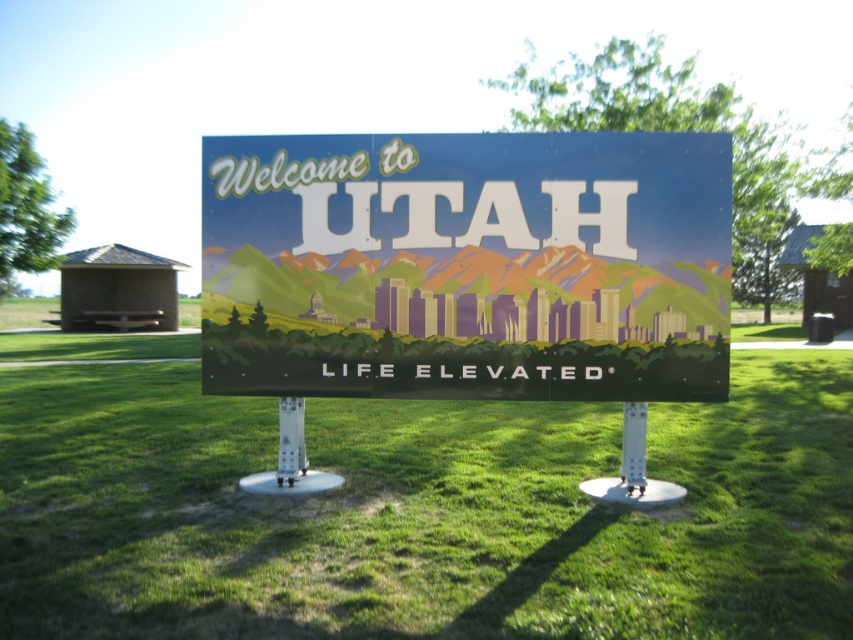
Question: Which point appears closest to the camera in this image?

Choices:
 (A) (634, 278)
 (B) (635, 484)
 (C) (604, 435)

Answer: (A)

Question: Does green grass at center have a larger size compared to white plastic pole at center?

Choices:
 (A) no
 (B) yes

Answer: (B)

Question: Does matte plastic sign at center come behind white plastic pole at center?

Choices:
 (A) no
 (B) yes

Answer: (A)

Question: Estimate the real-world distances between objects in this image. Which object is farther from the matte plastic sign at center?

Choices:
 (A) white plastic pole at center
 (B) green grass at center

Answer: (B)

Question: Which of the following is the closest to the observer?

Choices:
 (A) (254, 561)
 (B) (641, 476)

Answer: (A)

Question: Is green grass at center wider than white plastic pole at center?

Choices:
 (A) yes
 (B) no

Answer: (A)